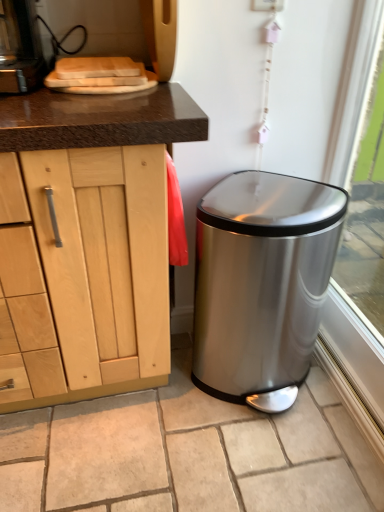
You are a GUI agent. You are given a task and a screenshot of the screen. Output one action in this format:
    pyautogui.click(x=<x>, y=<y>)
    Task: Click on the vacant space that is to the left of polished stainless steel trash can at lower right
    This screenshot has width=384, height=512.
    Given the screenshot: What is the action you would take?
    (152, 401)